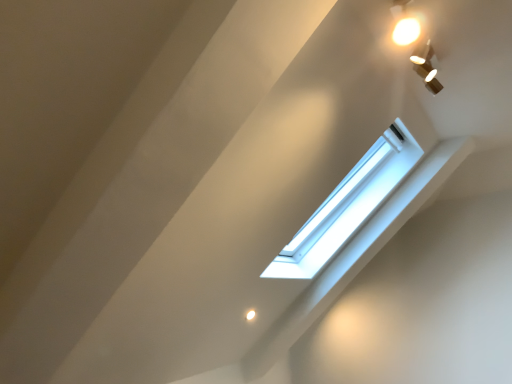
Question: Should I look upward or downward to see matte gold spotlight at upper right?

Choices:
 (A) down
 (B) up

Answer: (B)